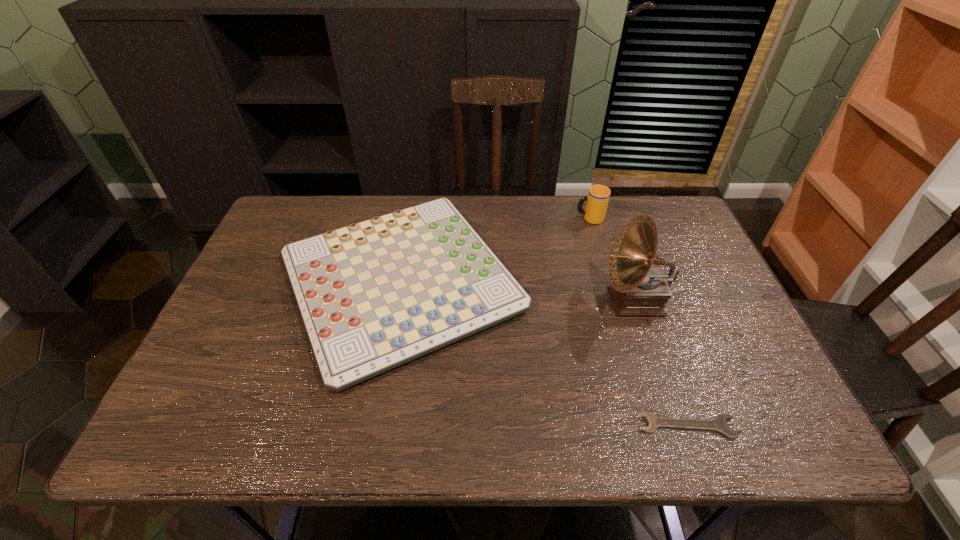
Identify the location of free space located on the side of the second tallest object with the handle. This screenshot has width=960, height=540. (456, 219).

In order to click on free region located on the side of the second tallest object with the handle in this screenshot , I will do `click(531, 219)`.

Locate an element on the screen. This screenshot has height=540, width=960. free space located 0.160m on the right of the second shortest object is located at coordinates (588, 282).

The width and height of the screenshot is (960, 540). I want to click on vacant space located 0.310m on the left of the nearest object, so click(x=487, y=426).

This screenshot has height=540, width=960. I want to click on cup present at the far edge, so click(597, 200).

At what (x,y) coordinates should I click in order to perform the action: click on gameboard that is at the far edge. Please return your answer as a coordinate pair (x, y). Image resolution: width=960 pixels, height=540 pixels. Looking at the image, I should click on (374, 295).

Locate an element on the screen. The height and width of the screenshot is (540, 960). object located in the near edge section of the desktop is located at coordinates (718, 424).

Locate an element on the screen. Image resolution: width=960 pixels, height=540 pixels. object that is positioned at the left edge is located at coordinates (374, 295).

Identify the location of phonograph record located in the right edge section of the desktop. (638, 289).

Where is `wrench at the right edge`? wrench at the right edge is located at coordinates (718, 424).